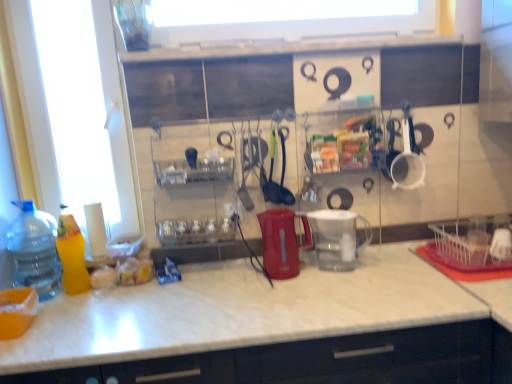
Find the location of a particular element. The image size is (512, 384). vacant area that lies in front of matte plastic kettle at center, which ranks as the 1th appliance in left-to-right order is located at coordinates (282, 295).